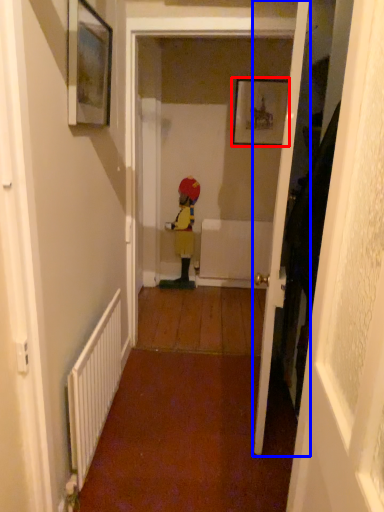
Question: Which of the following is the farthest to the observer, picture frame (highlighted by a red box) or door (highlighted by a blue box)?

Choices:
 (A) picture frame
 (B) door

Answer: (A)